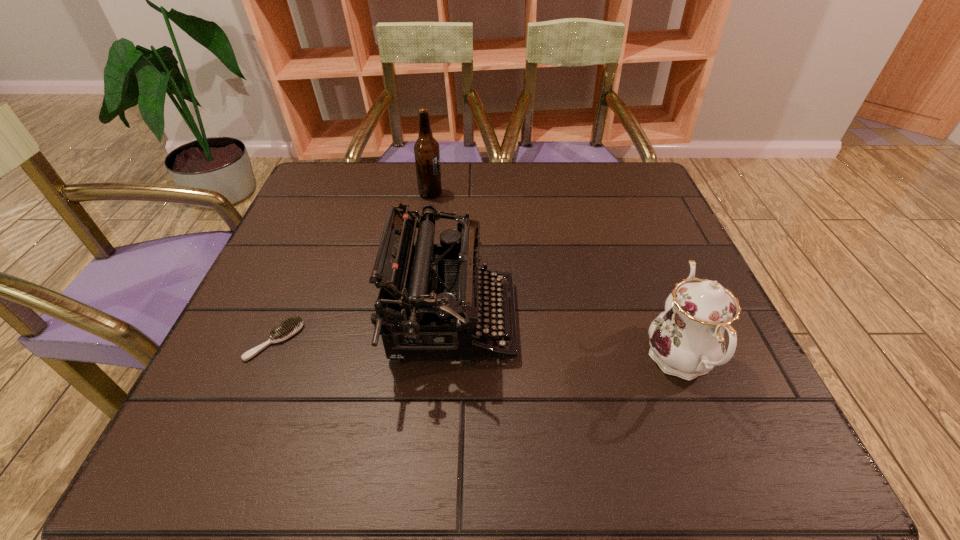
Where is `free space in the image that satisfies the following two spatial constraints: 1. on the keyboard of the typewriter; 2. on the right side of the rightmost object`? This screenshot has width=960, height=540. free space in the image that satisfies the following two spatial constraints: 1. on the keyboard of the typewriter; 2. on the right side of the rightmost object is located at coordinates (449, 359).